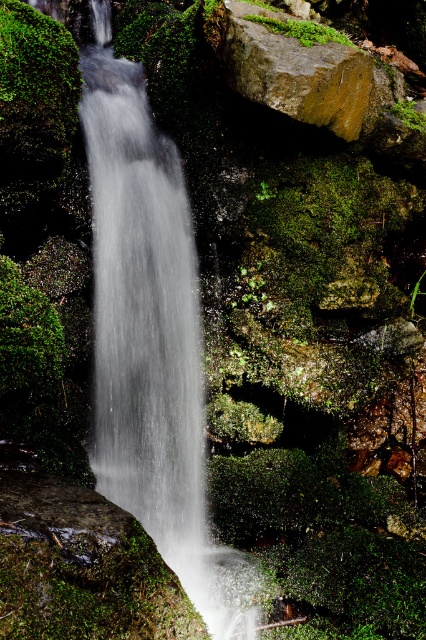
Question: Considering the relative positions of white frothy water at center and green mossy rock at upper center in the image provided, where is white frothy water at center located with respect to green mossy rock at upper center?

Choices:
 (A) above
 (B) below

Answer: (B)

Question: In this image, where is white frothy water at center located relative to green mossy rock at upper center?

Choices:
 (A) below
 (B) above

Answer: (A)

Question: Which point is closer to the camera?

Choices:
 (A) green mossy rock at upper center
 (B) white frothy water at center

Answer: (B)

Question: Which object is farther from the camera taking this photo?

Choices:
 (A) white frothy water at center
 (B) green mossy rock at upper center

Answer: (B)

Question: Observing the image, what is the correct spatial positioning of white frothy water at center in reference to green mossy rock at upper center?

Choices:
 (A) left
 (B) right

Answer: (A)